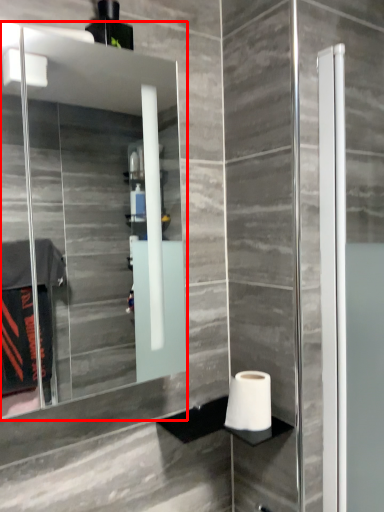
Question: In this image, where is mirror (annotated by the red box) located relative to toilet paper?

Choices:
 (A) left
 (B) right

Answer: (A)